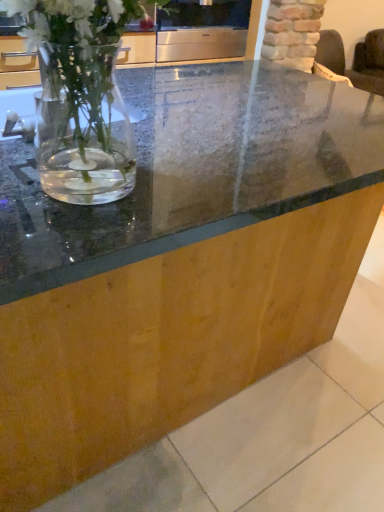
What do you see at coordinates (369, 63) in the screenshot?
I see `dark brown fabric armchair at upper right` at bounding box center [369, 63].

Image resolution: width=384 pixels, height=512 pixels. What are the coordinates of `dark brown fabric armchair at upper right` in the screenshot? It's located at (369, 63).

Image resolution: width=384 pixels, height=512 pixels. What are the coordinates of `satin silver oven at upper center` in the screenshot? It's located at (202, 30).

What do you see at coordinates (202, 30) in the screenshot? I see `satin silver oven at upper center` at bounding box center [202, 30].

Locate an element on the screen. dark brown fabric armchair at upper right is located at coordinates (369, 63).

Can you confirm if satin silver oven at upper center is positioned to the right of dark brown fabric armchair at upper right?

No, satin silver oven at upper center is not to the right of dark brown fabric armchair at upper right.

Is satin silver oven at upper center positioned before dark brown fabric armchair at upper right?

Yes, the depth of satin silver oven at upper center is less than that of dark brown fabric armchair at upper right.

Does point (163, 48) appear closer or farther from the camera than point (378, 78)?

Point (163, 48) is positioned closer to the camera compared to point (378, 78).

From the image's perspective, which one is positioned lower, satin silver oven at upper center or dark brown fabric armchair at upper right?

satin silver oven at upper center, from the image's perspective.

From a real-world perspective, which is physically above, satin silver oven at upper center or dark brown fabric armchair at upper right?

In real-world perspective, satin silver oven at upper center is above.

Considering the sizes of objects satin silver oven at upper center and dark brown fabric armchair at upper right in the image provided, who is wider, satin silver oven at upper center or dark brown fabric armchair at upper right?

dark brown fabric armchair at upper right.

Can you confirm if satin silver oven at upper center is shorter than dark brown fabric armchair at upper right?

Yes, satin silver oven at upper center is shorter than dark brown fabric armchair at upper right.

Considering the sizes of objects satin silver oven at upper center and dark brown fabric armchair at upper right in the image provided, who is smaller, satin silver oven at upper center or dark brown fabric armchair at upper right?

Smaller between the two is satin silver oven at upper center.

Consider the image. Would you say satin silver oven at upper center contains dark brown fabric armchair at upper right?

Definitely not — dark brown fabric armchair at upper right is not inside satin silver oven at upper center.

Are satin silver oven at upper center and dark brown fabric armchair at upper right located far from each other?

That's right, there is a large distance between satin silver oven at upper center and dark brown fabric armchair at upper right.

Is satin silver oven at upper center positioned with its back to dark brown fabric armchair at upper right?

No, satin silver oven at upper center is not facing the opposite direction of dark brown fabric armchair at upper right.

How many degrees apart are the facing directions of satin silver oven at upper center and dark brown fabric armchair at upper right?

0.000225 degrees.

Image resolution: width=384 pixels, height=512 pixels. I want to click on appliance in front of the dark brown fabric armchair at upper right, so click(x=202, y=30).

Which object is positioned more to the right, dark brown fabric armchair at upper right or satin silver oven at upper center?

From the viewer's perspective, dark brown fabric armchair at upper right appears more on the right side.

Which object is closer to the camera taking this photo, dark brown fabric armchair at upper right or satin silver oven at upper center?

Positioned in front is satin silver oven at upper center.

Between point (354, 59) and point (182, 36), which one is positioned in front?

Positioned in front is point (182, 36).

From the image's perspective, which is below, dark brown fabric armchair at upper right or satin silver oven at upper center?

satin silver oven at upper center is shown below in the image.

From a real-world perspective, is dark brown fabric armchair at upper right beneath satin silver oven at upper center?

Yes, from a real-world perspective, dark brown fabric armchair at upper right is under satin silver oven at upper center.

Looking at their sizes, would you say dark brown fabric armchair at upper right is wider or thinner than satin silver oven at upper center?

Considering their sizes, dark brown fabric armchair at upper right looks broader than satin silver oven at upper center.

Which of these two, dark brown fabric armchair at upper right or satin silver oven at upper center, stands taller?

With more height is dark brown fabric armchair at upper right.

Who is smaller, dark brown fabric armchair at upper right or satin silver oven at upper center?

With smaller size is satin silver oven at upper center.

Is dark brown fabric armchair at upper right completely or partially outside of satin silver oven at upper center?

Yes.

Is dark brown fabric armchair at upper right placed right next to satin silver oven at upper center?

No, dark brown fabric armchair at upper right is not touching satin silver oven at upper center.

Is dark brown fabric armchair at upper right oriented away from satin silver oven at upper center?

That's not correct — dark brown fabric armchair at upper right is not looking away from satin silver oven at upper center.

Can you tell me how much dark brown fabric armchair at upper right and satin silver oven at upper center differ in facing direction?

0.000225 degrees.

I want to click on appliance on the left of the dark brown fabric armchair at upper right, so click(202, 30).

Find the location of a particular element. appliance above the dark brown fabric armchair at upper right (from a real-world perspective) is located at coordinates (202, 30).

Where is `armchair below the satin silver oven at upper center (from a real-world perspective)`? The image size is (384, 512). armchair below the satin silver oven at upper center (from a real-world perspective) is located at coordinates (369, 63).